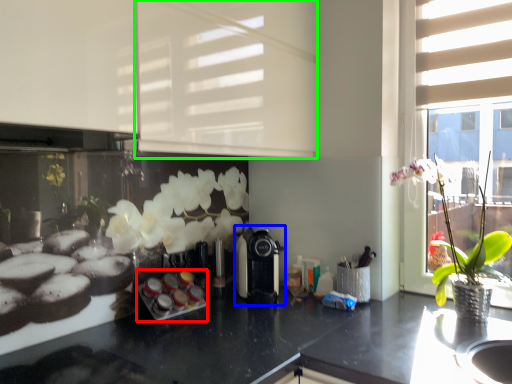
Question: Which object is the farthest from appliance (highlighted by a red box)? Choose among these: coffee machine (highlighted by a blue box) or shutter (highlighted by a green box).

Choices:
 (A) coffee machine
 (B) shutter

Answer: (B)